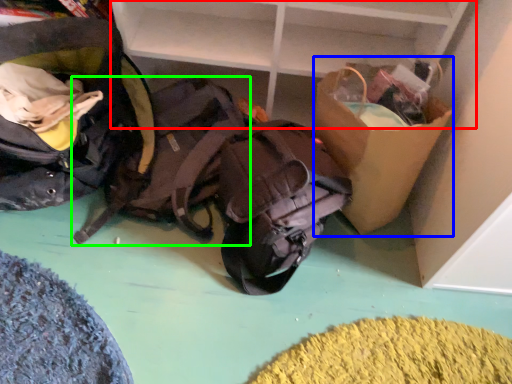
Question: Estimate the real-world distances between objects in this image. Which object is closer to shelf (highlighted by a red box), cardboard box (highlighted by a blue box) or backpack (highlighted by a green box)?

Choices:
 (A) cardboard box
 (B) backpack

Answer: (A)